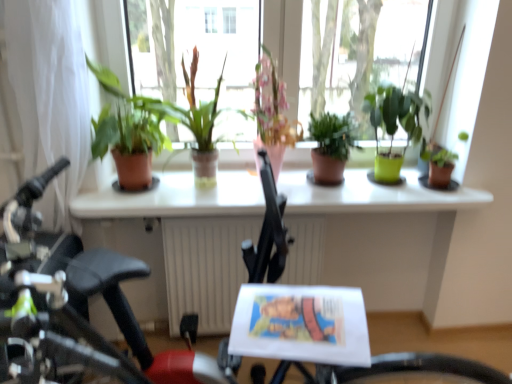
Question: Is white sheer curtain at left taller than green matte plant at right, positioned as the 1th houseplant in right-to-left order?

Choices:
 (A) yes
 (B) no

Answer: (A)

Question: Is white sheer curtain at left outside of green matte plant at right, positioned as the 1th houseplant in right-to-left order?

Choices:
 (A) yes
 (B) no

Answer: (A)

Question: Is white sheer curtain at left positioned far away from green matte plant at right, which is the 6th houseplant in left-to-right order?

Choices:
 (A) no
 (B) yes

Answer: (B)

Question: Can you confirm if white sheer curtain at left is smaller than green matte plant at right, positioned as the 1th houseplant in right-to-left order?

Choices:
 (A) no
 (B) yes

Answer: (A)

Question: From the image's perspective, is white sheer curtain at left beneath green matte plant at right, which is the 6th houseplant in left-to-right order?

Choices:
 (A) no
 (B) yes

Answer: (A)

Question: Can you confirm if white sheer curtain at left is positioned to the right of green matte plant at right, positioned as the 1th houseplant in right-to-left order?

Choices:
 (A) yes
 (B) no

Answer: (B)

Question: Is white sheer curtain at left wider than white glossy window sill at center?

Choices:
 (A) yes
 (B) no

Answer: (B)

Question: From the image's perspective, is white sheer curtain at left located beneath white glossy window sill at center?

Choices:
 (A) yes
 (B) no

Answer: (B)

Question: Is the position of white sheer curtain at left less distant than that of white glossy window sill at center?

Choices:
 (A) no
 (B) yes

Answer: (B)

Question: From a real-world perspective, is white sheer curtain at left positioned over white glossy window sill at center based on gravity?

Choices:
 (A) no
 (B) yes

Answer: (B)

Question: Can you confirm if white sheer curtain at left is taller than white glossy window sill at center?

Choices:
 (A) no
 (B) yes

Answer: (B)

Question: From the image's perspective, is white sheer curtain at left located above white glossy window sill at center?

Choices:
 (A) yes
 (B) no

Answer: (A)

Question: From a real-world perspective, is white sheer curtain at left located higher than terracotta pot at center, which ranks as the 5th houseplant in right-to-left order?

Choices:
 (A) yes
 (B) no

Answer: (B)